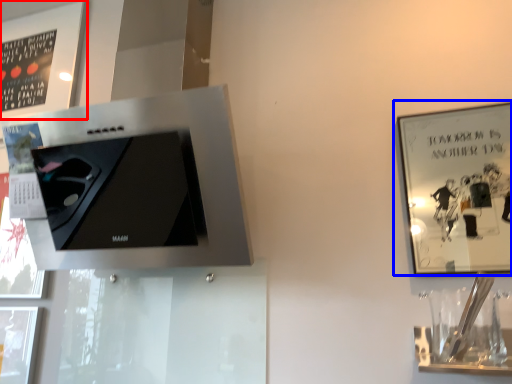
Question: Which point is closer to the camera, picture frame (highlighted by a red box) or picture frame (highlighted by a blue box)?

Choices:
 (A) picture frame
 (B) picture frame

Answer: (B)